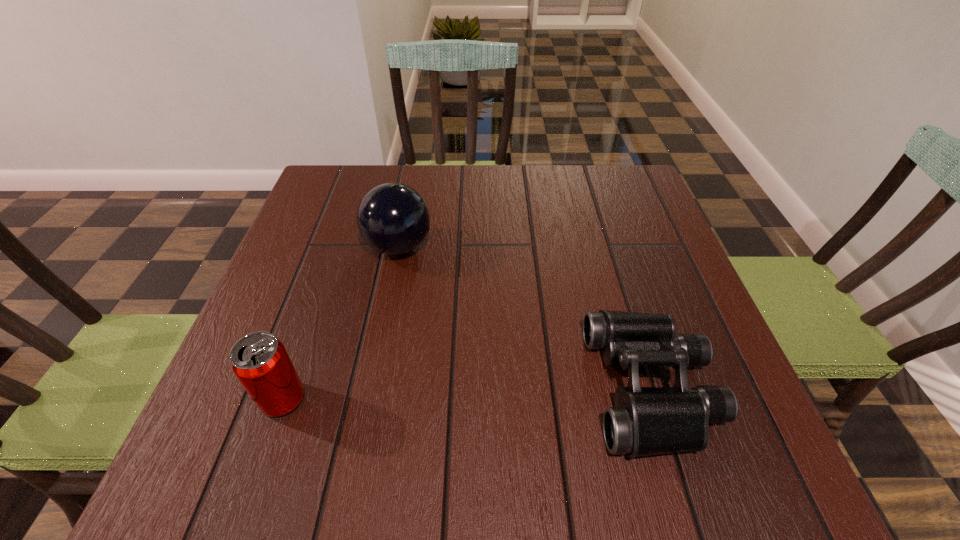
What are the coordinates of `free space at the far right corner of the desktop` in the screenshot? It's located at (592, 192).

You are a GUI agent. You are given a task and a screenshot of the screen. Output one action in this format:
    pyautogui.click(x=<x>, y=<y>)
    Task: Click on the empty space between the leftmost object and the rightmost object
    This screenshot has width=960, height=540.
    Given the screenshot: What is the action you would take?
    pyautogui.click(x=468, y=393)

Image resolution: width=960 pixels, height=540 pixels. I want to click on free space that is in between the soda can and the farthest object, so click(341, 323).

At what (x,y) coordinates should I click in order to perform the action: click on blank region between the leftmost object and the shortest object. Please return your answer as a coordinate pair (x, y). The height and width of the screenshot is (540, 960). Looking at the image, I should click on (468, 393).

Where is `free space between the binoculars and the farthest object`? The image size is (960, 540). free space between the binoculars and the farthest object is located at coordinates (525, 317).

The image size is (960, 540). I want to click on unoccupied position between the leftmost object and the binoculars, so click(x=468, y=393).

Identify the location of vacant point located between the second object from left to right and the soda can. The image size is (960, 540). (341, 323).

Image resolution: width=960 pixels, height=540 pixels. I want to click on free spot between the shortest object and the soda can, so click(468, 393).

Locate an element on the screen. This screenshot has height=540, width=960. free point between the binoculars and the soda can is located at coordinates (468, 393).

Locate an element on the screen. vacant space in between the bowling ball and the leftmost object is located at coordinates (341, 323).